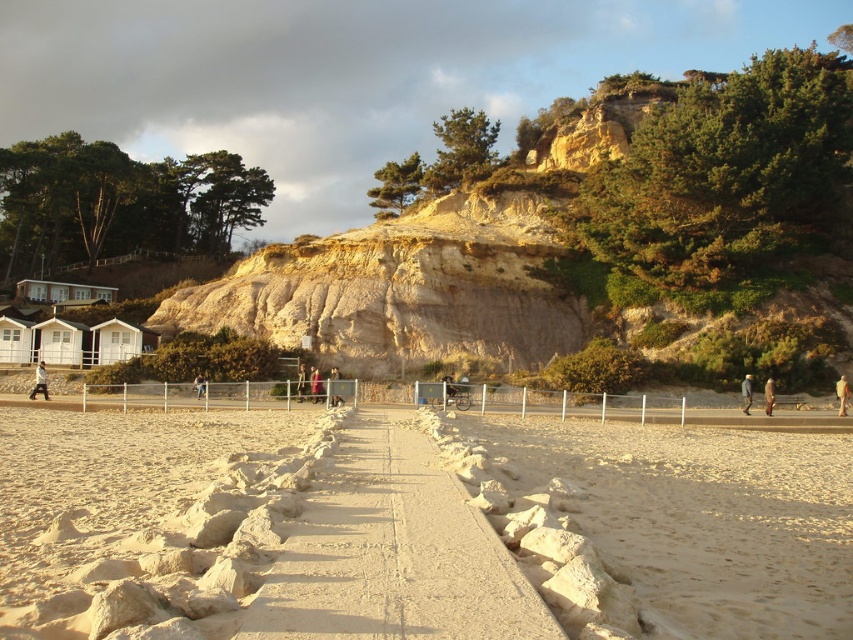
Does beige sand at center appear on the right side of pink fabric dress at center?

Indeed, beige sand at center is positioned on the right side of pink fabric dress at center.

Which is above, beige sand at center or pink fabric dress at center?

Positioned higher is pink fabric dress at center.

This screenshot has height=640, width=853. In order to click on beige sand at center in this screenshot , I will do `click(701, 518)`.

At what (x,y) coordinates should I click in order to perform the action: click on beige sand at center. Please return your answer as a coordinate pair (x, y). Looking at the image, I should click on (701, 518).

Is red wool coat at center smaller than light brown leather jacket at center?

Actually, red wool coat at center might be larger than light brown leather jacket at center.

Is red wool coat at center below light brown leather jacket at center?

Actually, red wool coat at center is above light brown leather jacket at center.

Which is behind, point (316, 397) or point (195, 376)?

Point (195, 376)

Locate an element on the screen. red wool coat at center is located at coordinates (316, 385).

Describe the element at coordinates (393, 552) in the screenshot. I see `sandy concrete path at center` at that location.

Image resolution: width=853 pixels, height=640 pixels. I want to click on sandy concrete path at center, so click(x=393, y=552).